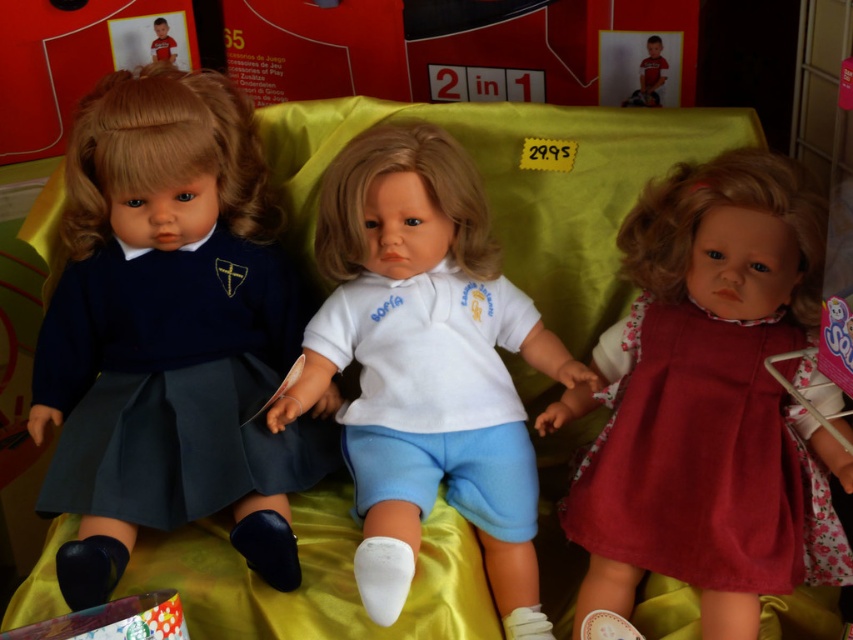
You are a customer in a store looking at the dolls. You want to buy the doll wearing the navy blue fabric dress at left. Which side of the white matte shirt at center should you look to find it?

The navy blue fabric dress at left is positioned on the left side of the white matte shirt at center, so you should look to the left side of the white matte shirt at center to find the navy blue fabric dress at left.

You are a store employee arranging items on a shelf. You have the matte red dress at center and the white cotton shirt at center. The shelf has a space that can only fit one of them. Which item should you place on the shelf based on their size?

The matte red dress at center is bigger than the white cotton shirt at center, so you should place the white cotton shirt at center on the shelf since it is smaller and will fit in the available space.

You are a store employee who needs to place a rectangular box that is 12 inches long between the matte red dress at center and the white cotton shirt at center. Can the box fit between them without overlapping either item?

The distance between the matte red dress at center and the white cotton shirt at center is 10.79 inches. Since the box is 12 inches long, it cannot fit between them without overlapping either item.